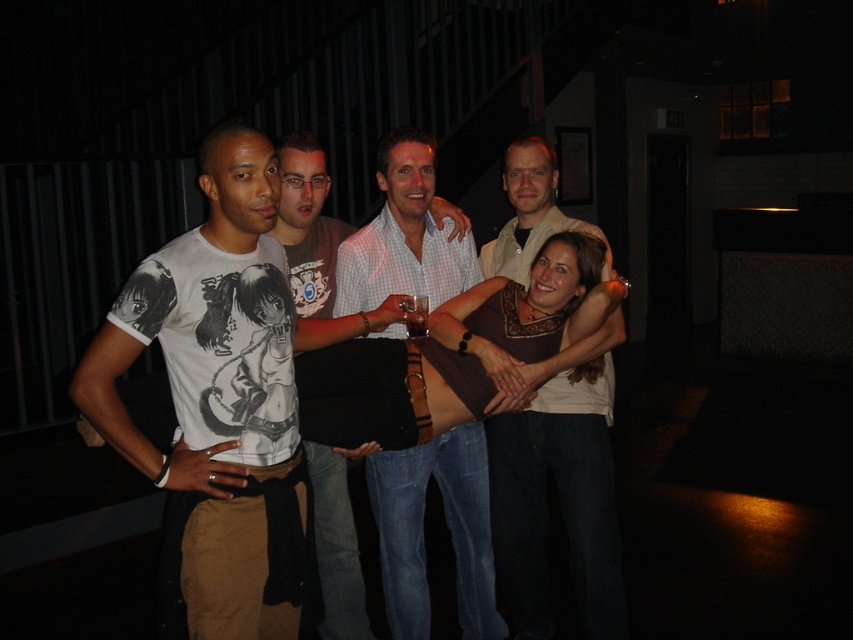
Consider the image. You are at a social event and want to grab the translucent glass beer at center without touching the light brown leather jacket at center. Is this possible based on their positions?

The light brown leather jacket at center is positioned on the right side of the translucent glass beer at center, so you can reach the translucent glass beer at center from the left side without touching the jacket.

You are standing in the dimly lit room with vertical metal bars in the background. You see two points marked in the image. Which point is closer to you, point 1 at (538, 486) or point 2 at (468, 452)?

Point 1 at (538, 486) is closer to you because it is further to the viewer than point 2 at (468, 452).